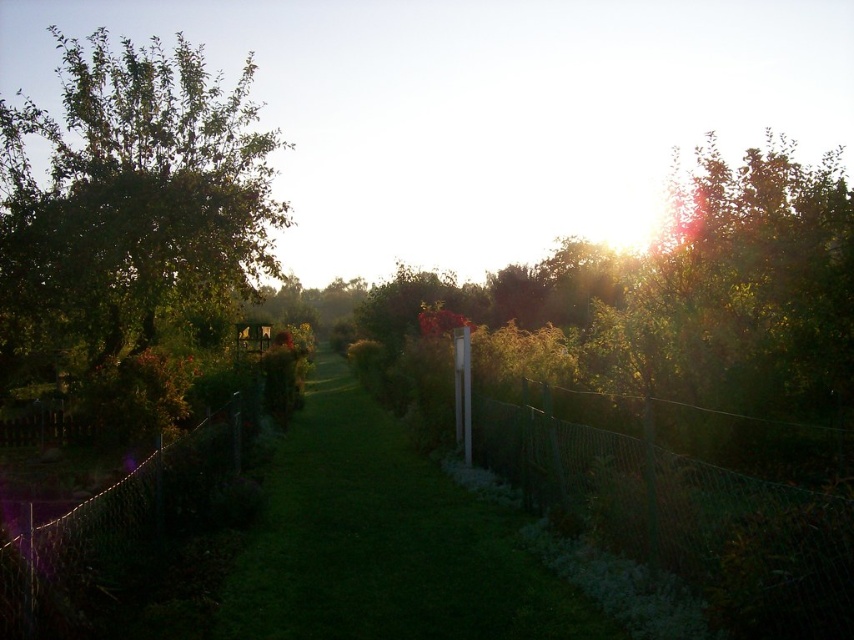
Question: Estimate the real-world distances between objects in this image. Which object is farther from the green grass at center?

Choices:
 (A) green wire mesh fence at right
 (B) green leafy tree at left
 (C) wire mesh fence at left

Answer: (B)

Question: Does green leafy tree at left appear over green grass at center?

Choices:
 (A) no
 (B) yes

Answer: (B)

Question: Among these objects, which one is farthest from the camera?

Choices:
 (A) wire mesh fence at left
 (B) green grass at center
 (C) green wire mesh fence at right

Answer: (C)

Question: Among these points, which one is nearest to the camera?

Choices:
 (A) (6, 580)
 (B) (148, 74)
 (C) (518, 612)
 (D) (581, 467)

Answer: (A)

Question: Does green wire mesh fence at right lie in front of wire mesh fence at left?

Choices:
 (A) yes
 (B) no

Answer: (B)

Question: Can you confirm if green leafy tree at left is bigger than wire mesh fence at left?

Choices:
 (A) no
 (B) yes

Answer: (B)